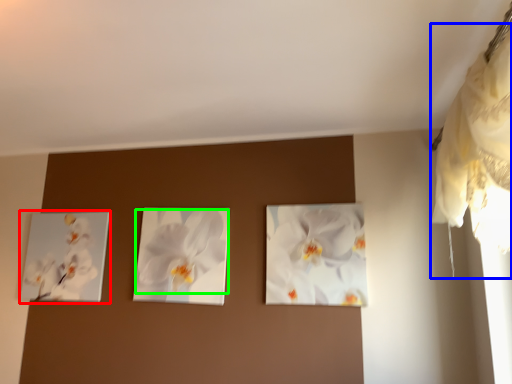
Question: Which is farther away from picture frame (highlighted by a red box)? curtain (highlighted by a blue box) or flower (highlighted by a green box)?

Choices:
 (A) curtain
 (B) flower

Answer: (A)